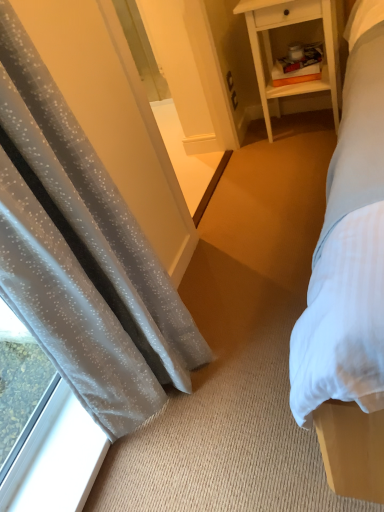
Identify the location of free space that is to the left of white wood nightstand at upper right. (258, 157).